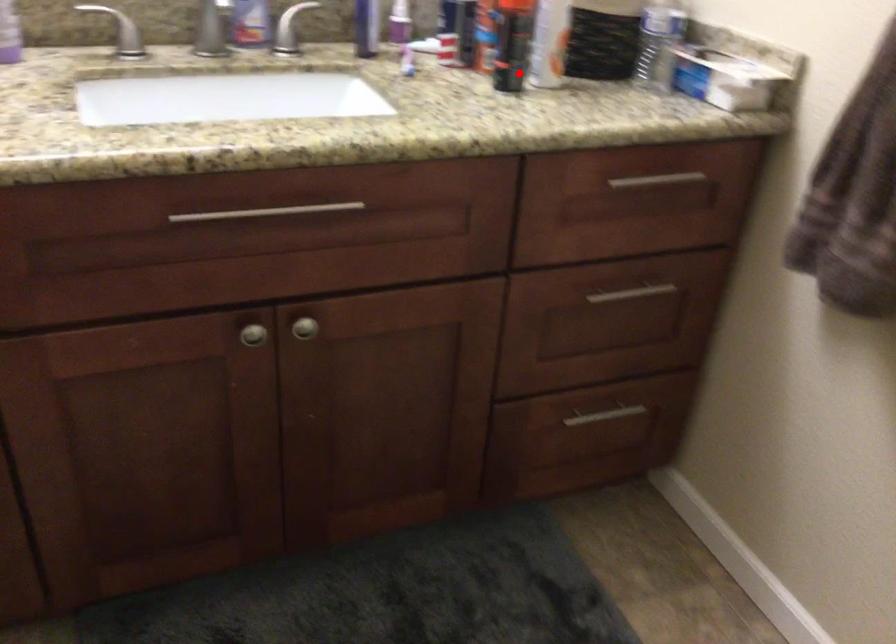
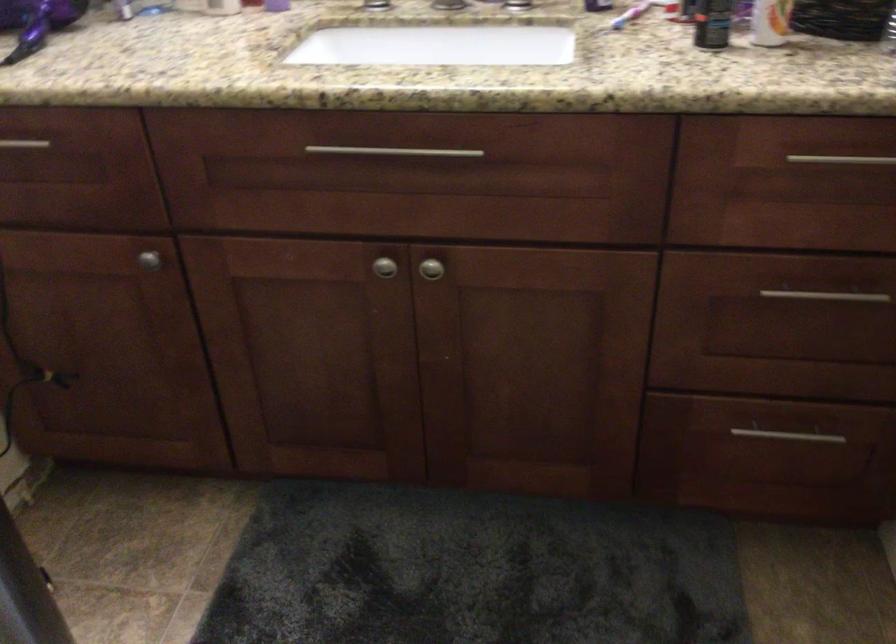
The point at the highlighted location is marked in the first image. Where is the corresponding point in the second image?

(712, 23)